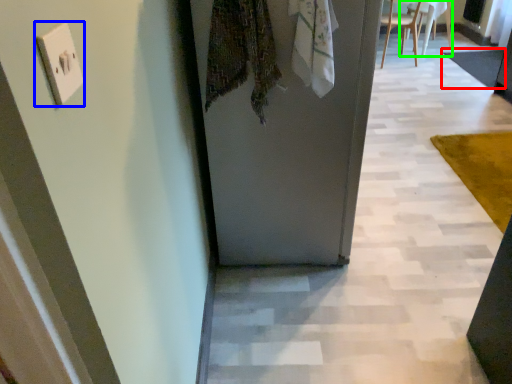
Question: Based on their relative distances, which object is farther from mat (highlighted by a red box)? Choose from electric outlet (highlighted by a blue box) and chair (highlighted by a green box).

Choices:
 (A) electric outlet
 (B) chair

Answer: (A)